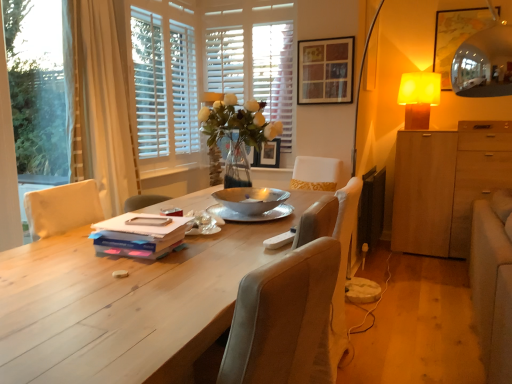
Question: Should I look upward or downward to see wooden picture frame at upper center, which appears as the second picture frame when viewed from the front?

Choices:
 (A) down
 (B) up

Answer: (B)

Question: From a real-world perspective, is wooden picture frame at upper center, which is the second picture frame in top-to-bottom order, located higher than yellow fabric lampshade at upper right?

Choices:
 (A) no
 (B) yes

Answer: (A)

Question: Considering the relative sizes of wooden picture frame at upper center, which appears as the second picture frame when viewed from the front, and yellow fabric lampshade at upper right in the image provided, is wooden picture frame at upper center, which appears as the second picture frame when viewed from the front, smaller than yellow fabric lampshade at upper right?

Choices:
 (A) yes
 (B) no

Answer: (A)

Question: Considering the relative sizes of wooden picture frame at upper center, which appears as the second picture frame when viewed from the front, and yellow fabric lampshade at upper right in the image provided, is wooden picture frame at upper center, which appears as the second picture frame when viewed from the front, taller than yellow fabric lampshade at upper right?

Choices:
 (A) yes
 (B) no

Answer: (B)

Question: From the image's perspective, is wooden picture frame at upper center, which appears as the second picture frame when viewed from the front, located above yellow fabric lampshade at upper right?

Choices:
 (A) no
 (B) yes

Answer: (A)

Question: Does wooden picture frame at upper center, which appears as the first picture frame when viewed from the back, contain yellow fabric lampshade at upper right?

Choices:
 (A) no
 (B) yes

Answer: (A)

Question: From a real-world perspective, is wooden picture frame at upper center, the 2th picture frame viewed from the right, physically below yellow fabric lampshade at upper right?

Choices:
 (A) no
 (B) yes

Answer: (B)

Question: Considering the relative sizes of light brown wood cabinet at right and beige fabric curtain at left in the image provided, is light brown wood cabinet at right bigger than beige fabric curtain at left?

Choices:
 (A) no
 (B) yes

Answer: (B)

Question: Can you confirm if light brown wood cabinet at right is thinner than beige fabric curtain at left?

Choices:
 (A) no
 (B) yes

Answer: (A)

Question: Can you confirm if light brown wood cabinet at right is taller than beige fabric curtain at left?

Choices:
 (A) yes
 (B) no

Answer: (B)

Question: From the image's perspective, is light brown wood cabinet at right located beneath beige fabric curtain at left?

Choices:
 (A) no
 (B) yes

Answer: (B)

Question: Is light brown wood cabinet at right in front of beige fabric curtain at left?

Choices:
 (A) no
 (B) yes

Answer: (A)

Question: Is light brown wood cabinet at right at the left side of beige fabric curtain at left?

Choices:
 (A) yes
 (B) no

Answer: (B)

Question: Would you say transparent plastic window screen at left is part of wooden picture frame at upper center, which appears as the first picture frame when viewed from the back,'s contents?

Choices:
 (A) no
 (B) yes

Answer: (A)